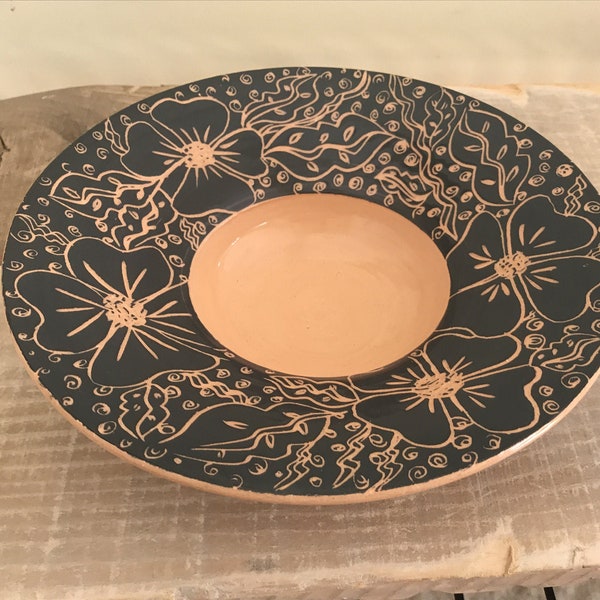
Image resolution: width=600 pixels, height=600 pixels. Find the location of `grout lines or scratches in stone`. grout lines or scratches in stone is located at coordinates (58, 496).